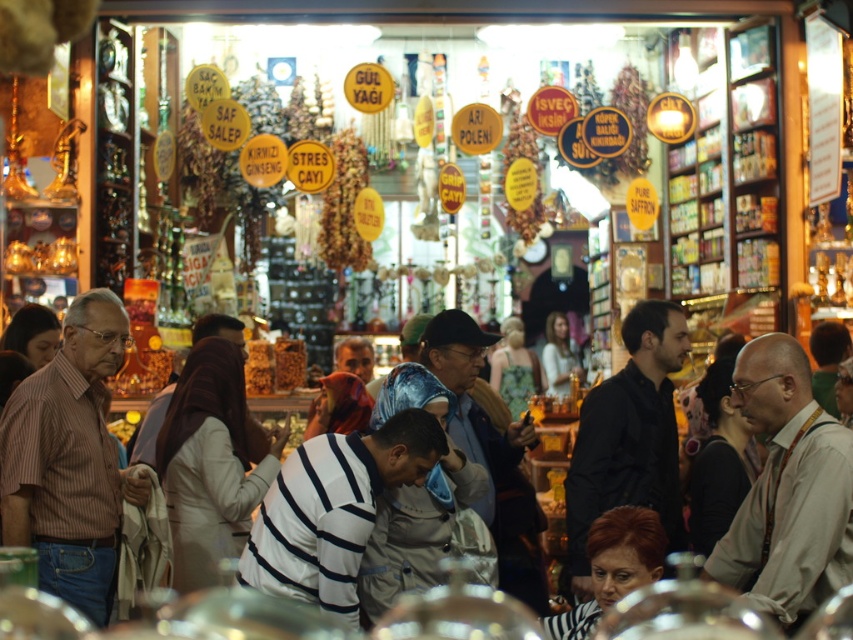
Question: Can you confirm if brown striped shirt at left is positioned below white striped shirt at center?

Choices:
 (A) no
 (B) yes

Answer: (A)

Question: Is black shirt at center thinner than dark brown hair at lower center?

Choices:
 (A) no
 (B) yes

Answer: (A)

Question: Which of the following is the farthest from the observer?

Choices:
 (A) striped fabric shirt at center
 (B) black shirt at center

Answer: (B)

Question: Which point appears closest to the camera in this image?

Choices:
 (A) (245, 554)
 (B) (648, 404)
 (C) (802, 598)
 (D) (76, 413)

Answer: (C)

Question: Can you confirm if brown leather shirt at right is smaller than black shirt at center?

Choices:
 (A) no
 (B) yes

Answer: (B)

Question: Estimate the real-world distances between objects in this image. Which object is farther from the black shirt at center?

Choices:
 (A) brown leather shirt at right
 (B) dark brown hair at lower center
 (C) brown striped shirt at left
 (D) striped fabric shirt at center

Answer: (C)